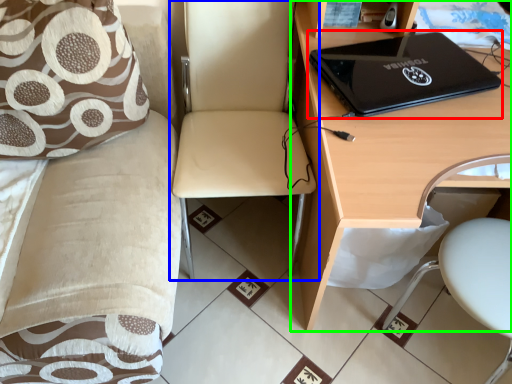
Question: Estimate the real-world distances between objects in this image. Which object is farther from laptop (highlighted by a red box), chair (highlighted by a blue box) or desk (highlighted by a green box)?

Choices:
 (A) chair
 (B) desk

Answer: (A)